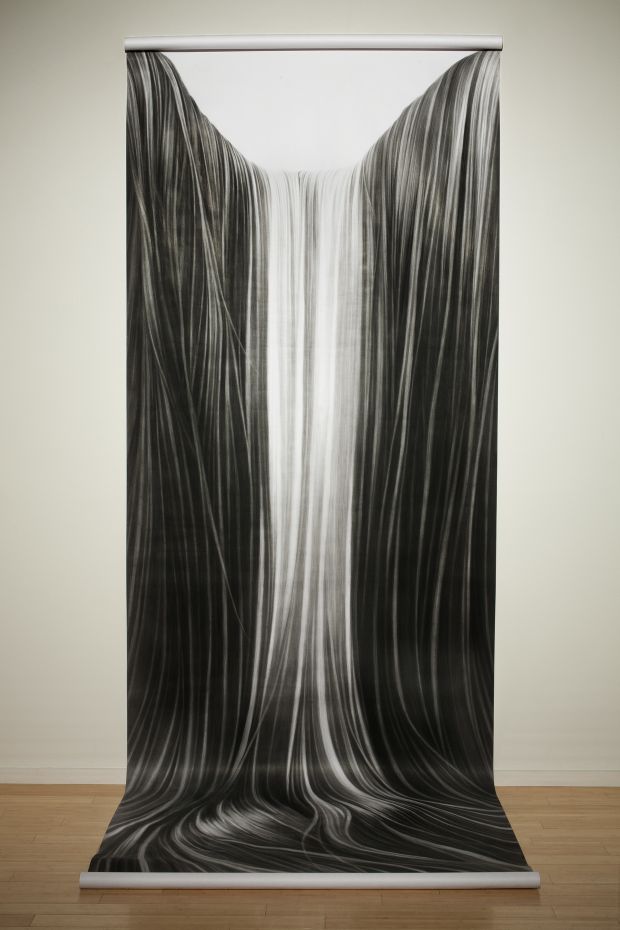
This screenshot has width=620, height=930. Identify the location of white baseboard. (56, 774), (586, 780).